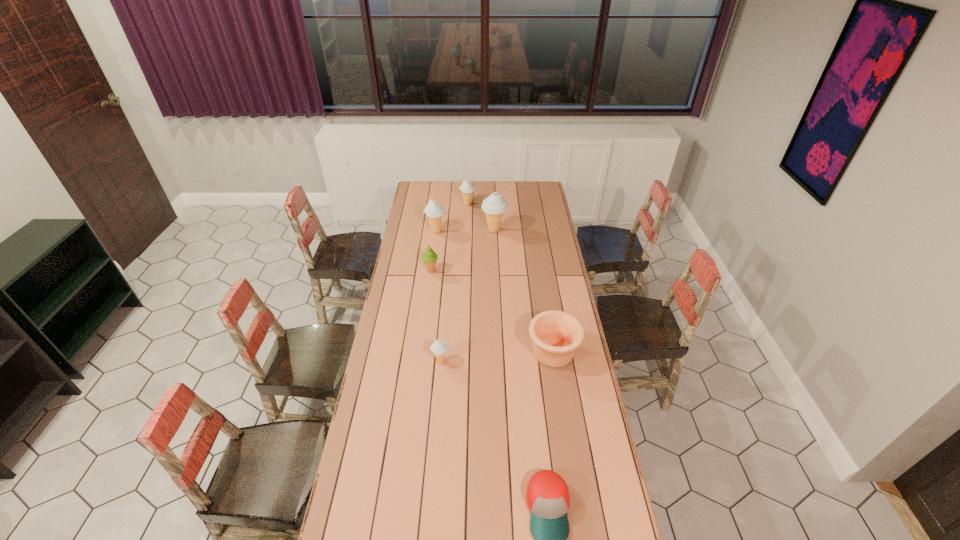
The width and height of the screenshot is (960, 540). Find the location of `the shortest icecream`. the shortest icecream is located at coordinates (439, 348).

What are the coordinates of `vacant space situated 0.130m on the front of the tallest icecream` in the screenshot? It's located at (494, 252).

Locate an element on the screen. The image size is (960, 540). free space located on the front of the second biggest beige icecream is located at coordinates (434, 248).

Locate an element on the screen. This screenshot has width=960, height=540. blank space located on the left of the third beige icecream from left to right is located at coordinates (432, 204).

Identify the location of free space located 0.150m on the front of the fourth nearest object. The height and width of the screenshot is (540, 960). (427, 297).

Where is `free space located on the back of the pottery`? free space located on the back of the pottery is located at coordinates (542, 286).

Identify the location of vacant region located 0.070m on the back of the nearest icecream. The image size is (960, 540). (443, 342).

Locate an element on the screen. This screenshot has width=960, height=540. object that is at the right edge is located at coordinates (556, 335).

In the image, there is a desktop. Identify the location of free space at the far edge. This screenshot has width=960, height=540. (516, 189).

Locate an element on the screen. free location at the left edge of the desktop is located at coordinates (365, 450).